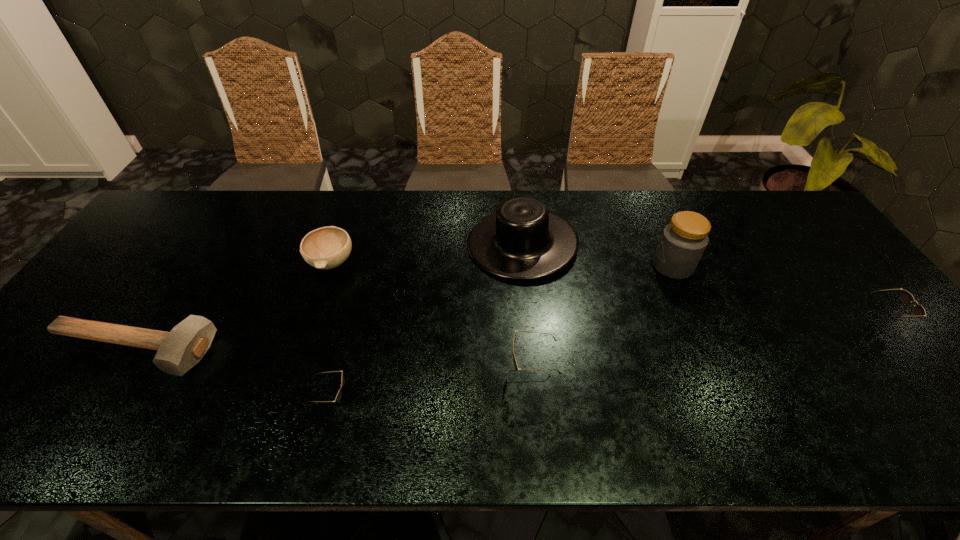
The width and height of the screenshot is (960, 540). I want to click on object positioned at the far edge, so click(522, 240).

Image resolution: width=960 pixels, height=540 pixels. I want to click on mallet that is at the near edge, so click(x=179, y=350).

Locate an element on the screen. object that is at the left edge is located at coordinates (179, 350).

You are a GUI agent. You are given a task and a screenshot of the screen. Output one action in this format:
    pyautogui.click(x=<x>, y=<y>)
    Task: Click on the object located in the right edge section of the desktop
    The height and width of the screenshot is (540, 960).
    Given the screenshot: What is the action you would take?
    pyautogui.click(x=906, y=297)

I want to click on object situated at the near left corner, so click(x=179, y=350).

In the image, there is a desktop. At what (x,y) coordinates should I click in order to perform the action: click on vacant area at the far edge. Please return your answer as a coordinate pair (x, y). The image size is (960, 540). Looking at the image, I should click on (549, 198).

You are a GUI agent. You are given a task and a screenshot of the screen. Output one action in this format:
    pyautogui.click(x=<x>, y=<y>)
    Task: Click on the vacant area at the near edge
    This screenshot has height=540, width=960.
    Given the screenshot: What is the action you would take?
    pyautogui.click(x=162, y=376)

This screenshot has height=540, width=960. What are the coordinates of `vacant position at the left edge of the desktop` in the screenshot? It's located at (138, 259).

In the image, there is a desktop. What are the coordinates of `vacant space at the right edge` in the screenshot? It's located at (797, 253).

In the image, there is a desktop. At what (x,y) coordinates should I click in order to perform the action: click on vacant space at the near left corner. Please return your answer as a coordinate pair (x, y). This screenshot has width=960, height=540. Looking at the image, I should click on (76, 390).